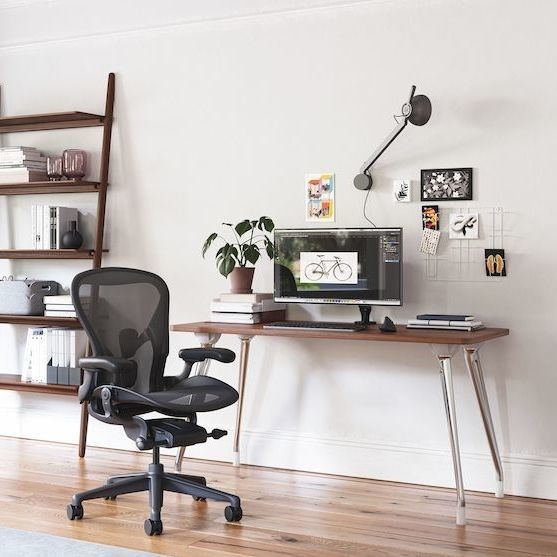
The height and width of the screenshot is (557, 557). What are the coordinates of `bookshelf` in the screenshot? It's located at tap(45, 257).